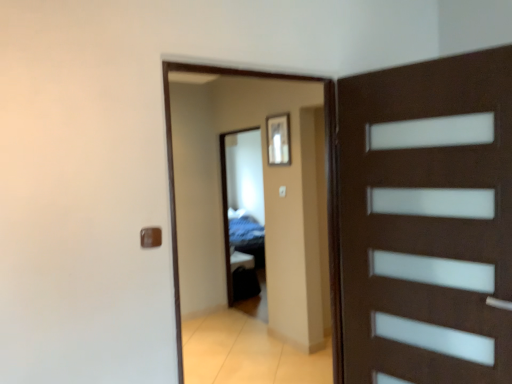
Question: Are transparent glass mirror at center and transparent glass door at center making contact?

Choices:
 (A) no
 (B) yes

Answer: (A)

Question: Is transparent glass door at center at the back of transparent glass mirror at center?

Choices:
 (A) no
 (B) yes

Answer: (A)

Question: Would you say transparent glass mirror at center is outside transparent glass door at center?

Choices:
 (A) no
 (B) yes

Answer: (B)

Question: Does transparent glass mirror at center contain transparent glass door at center?

Choices:
 (A) no
 (B) yes

Answer: (A)

Question: Considering the relative positions of transparent glass mirror at center and transparent glass door at center in the image provided, is transparent glass mirror at center to the right of transparent glass door at center from the viewer's perspective?

Choices:
 (A) yes
 (B) no

Answer: (B)

Question: From a real-world perspective, is transparent glass mirror at center positioned above or below transparent glass door at center?

Choices:
 (A) below
 (B) above

Answer: (A)

Question: Considering the positions of transparent glass mirror at center and transparent glass door at center in the image, is transparent glass mirror at center wider or thinner than transparent glass door at center?

Choices:
 (A) wide
 (B) thin

Answer: (B)

Question: Is transparent glass mirror at center taller or shorter than transparent glass door at center?

Choices:
 (A) short
 (B) tall

Answer: (B)

Question: In terms of size, does transparent glass mirror at center appear bigger or smaller than transparent glass door at center?

Choices:
 (A) big
 (B) small

Answer: (B)

Question: From a real-world perspective, is transparent glass mirror at center above or below brown matte door handle at lower left?

Choices:
 (A) above
 (B) below

Answer: (B)

Question: In terms of height, does transparent glass mirror at center look taller or shorter compared to brown matte door handle at lower left?

Choices:
 (A) tall
 (B) short

Answer: (A)

Question: Based on their sizes in the image, would you say transparent glass mirror at center is bigger or smaller than brown matte door handle at lower left?

Choices:
 (A) small
 (B) big

Answer: (B)

Question: From the image's perspective, is transparent glass mirror at center above or below brown matte door handle at lower left?

Choices:
 (A) above
 (B) below

Answer: (B)

Question: Relative to brown matte door handle at lower left, is transparent glass door at center in front or behind?

Choices:
 (A) front
 (B) behind

Answer: (B)

Question: Looking at their shapes, would you say transparent glass door at center is wider or thinner than brown matte door handle at lower left?

Choices:
 (A) wide
 (B) thin

Answer: (A)